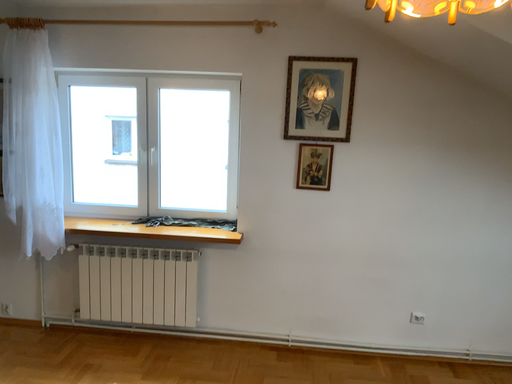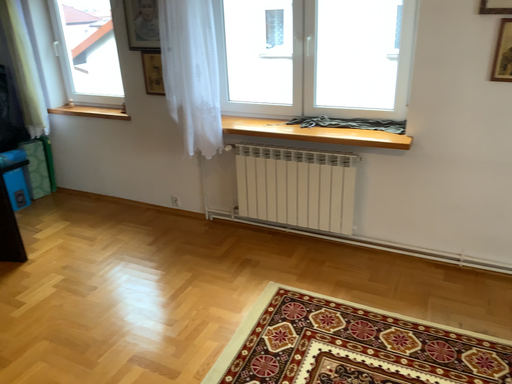
Question: Which way did the camera rotate in the video?

Choices:
 (A) rotated upward
 (B) rotated downward

Answer: (B)